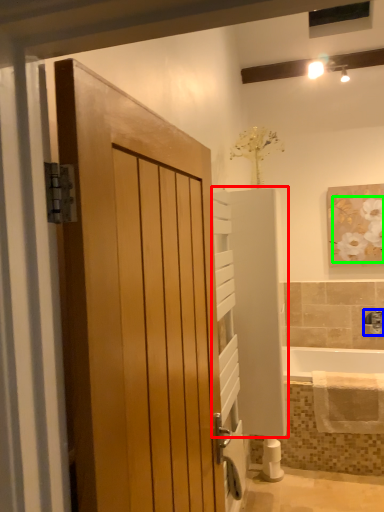
Question: Considering the real-world distances, which object is farthest from elevator (highlighted by a red box)? tap (highlighted by a blue box) or flower (highlighted by a green box)?

Choices:
 (A) tap
 (B) flower

Answer: (A)